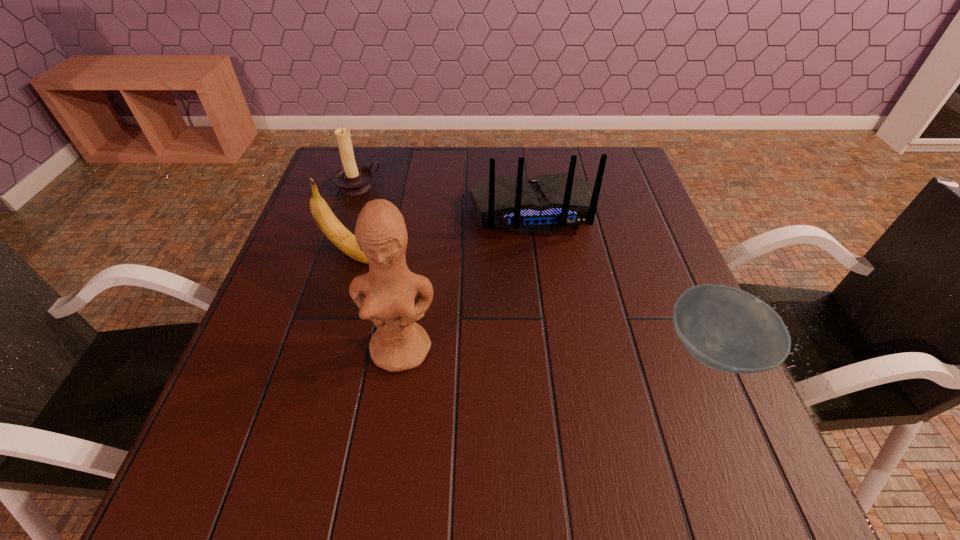
This screenshot has width=960, height=540. Identify the location of blank space at the right edge of the desktop. (620, 280).

Identify the location of free space at the near left corner of the desktop. (230, 431).

Image resolution: width=960 pixels, height=540 pixels. In the image, there is a desktop. Identify the location of vacant region at the far right corner. (642, 188).

Identify the location of free location at the near right corner of the desktop. (668, 435).

What are the coordinates of `vacant space that is in between the figurine and the fourth object from left to right` in the screenshot? It's located at (467, 280).

Locate an element on the screen. This screenshot has height=540, width=960. blank region between the figurine and the router is located at coordinates (467, 280).

Locate an element on the screen. This screenshot has width=960, height=540. free spot between the shortest object and the banana is located at coordinates (532, 302).

Image resolution: width=960 pixels, height=540 pixels. Identify the location of vacant space that is in between the candle holder and the banana. (354, 220).

Where is `free point between the fourth object from left to right and the banana`? The image size is (960, 540). free point between the fourth object from left to right and the banana is located at coordinates (442, 233).

In order to click on free point between the shortest object and the tallest object in this screenshot , I will do `click(558, 349)`.